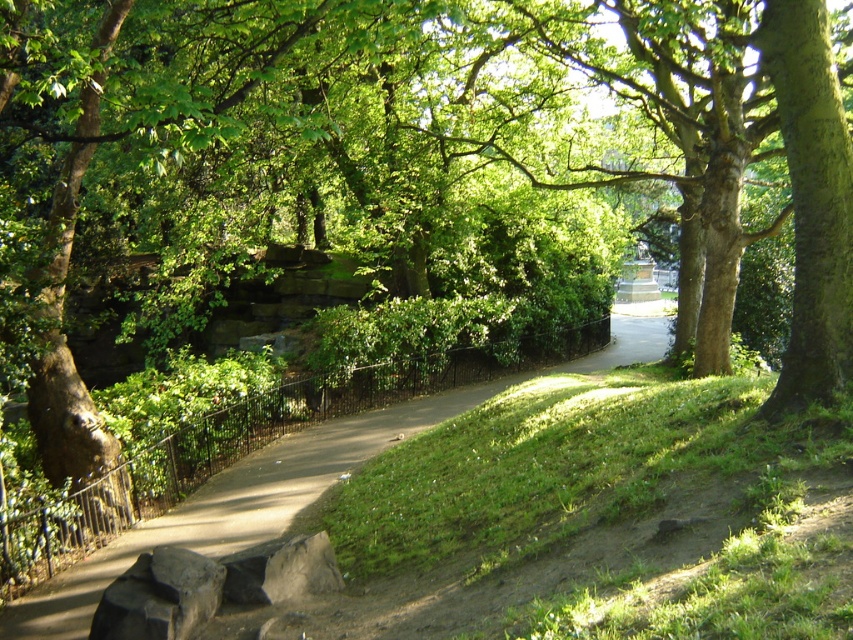
You are standing at the origin point in the park. The statue is located at coordinates 0.8, 0.25. Can you walk directly to the statue from your current position along the smooth concrete path at center?

The smooth concrete path at center is at coordinates (x=236, y=506), which is very close to the statue located at (x=212, y=512). Since the path leads towards the statue, you can walk directly to the statue along the smooth concrete path at center.

You are a person walking on the smooth concrete path at center in the park. You want to pick up the gray rough stone at lower center. Can you reach it from your current position?

The gray rough stone at lower center is behind the smooth concrete path at center, so you cannot reach it from your current position on the path.

You are a gardener carrying a wheelbarrow that is 3 meters wide. You need to move from the gray rough stone at lower center to the smooth concrete path at center. Is there enough space for your wheelbarrow to pass through the gap between them?

The smooth concrete path at center is 2.93 meters from the gray rough stone at lower center. Since the distance between them is less than the wheelbarrow width of 3 meters, the wheelbarrow cannot pass through the gap between them.